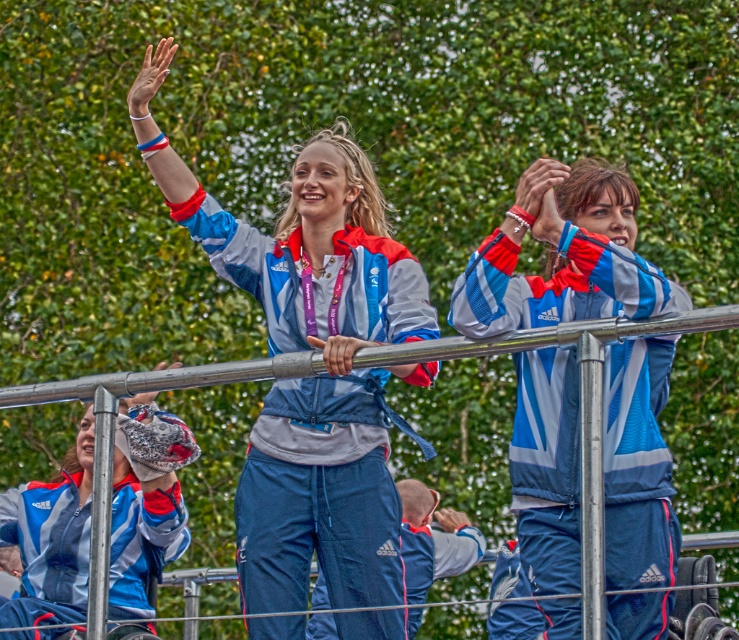
You are a photographer at the event and want to capture the matte blue tracksuit at center in your photo. What coordinates should you focus on to ensure it is centered in the frame?

You should focus on the coordinates point (321, 358) to center the matte blue tracksuit at center in your photo.

You are a photographer at the event and want to capture both the matte blue tracksuit at center and the blue reflective jacket at center in a single shot. Which one is on the left side of the other?

The matte blue tracksuit at center is positioned on the left side of the blue reflective jacket at center.